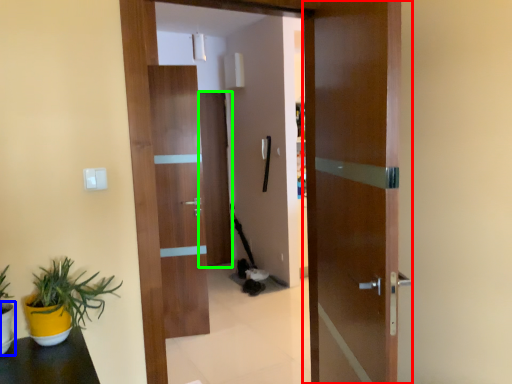
Question: Estimate the real-world distances between objects in this image. Which object is closer to door (highlighted by a red box), flowerpot (highlighted by a blue box) or door (highlighted by a green box)?

Choices:
 (A) flowerpot
 (B) door

Answer: (A)